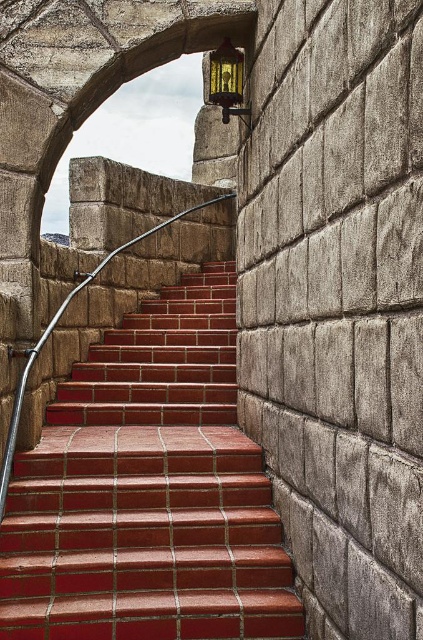
Question: Where is red brick stairs at center located in relation to polished metal handrail at center in the image?

Choices:
 (A) above
 (B) below

Answer: (B)

Question: Which point appears closest to the camera in this image?

Choices:
 (A) (227, 52)
 (B) (121, 504)
 (C) (33, 346)

Answer: (B)

Question: Is red brick stairs at center below gold textured lantern at upper center?

Choices:
 (A) no
 (B) yes

Answer: (B)

Question: Which point is farther from the camera taking this photo?

Choices:
 (A) (10, 426)
 (B) (195, 616)

Answer: (A)

Question: Is red brick stairs at center below polished metal handrail at center?

Choices:
 (A) yes
 (B) no

Answer: (A)

Question: Among these objects, which one is nearest to the camera?

Choices:
 (A) gold textured lantern at upper center
 (B) red brick stairs at center

Answer: (B)